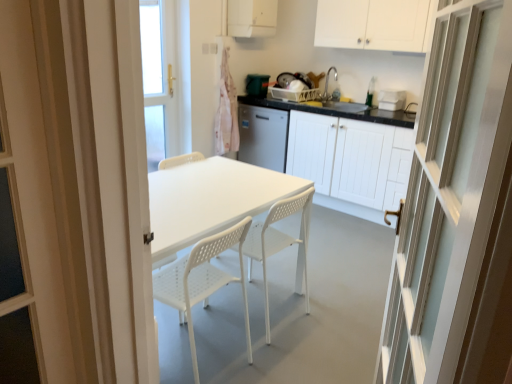
Question: Based on their sizes in the image, would you say white matte cabinet at upper center, the second cabinetry positioned from the top, is bigger or smaller than white plastic chair at center, which is the 1th chair from right to left?

Choices:
 (A) big
 (B) small

Answer: (A)

Question: Based on their positions, is white matte cabinet at upper center, which appears as the second cabinetry when ordered from the bottom, located to the left or right of white plastic chair at center, which is the 1th chair from right to left?

Choices:
 (A) left
 (B) right

Answer: (B)

Question: Which object is positioned farthest from the white plastic container at upper right, the first appliance positioned from the front?

Choices:
 (A) green plastic bin at upper center, positioned as the 2th appliance in front-to-back order
 (B) white matte cabinet at upper center, which appears as the second cabinetry when ordered from the bottom
 (C) white plastic chair at center, which is the second chair in right-to-left order
 (D) white plastic chair at center, which appears as the second chair when viewed from the left
 (E) white matte cabinet at upper center, the 1th cabinetry when ordered from top to bottom

Answer: (C)

Question: Considering the real-world distances, which object is farthest from the green plastic bin at upper center, which is the first appliance in back-to-front order?

Choices:
 (A) white matte cabinet at center, the 3th cabinetry from the top
 (B) white matte cabinet at upper center, the 1th cabinetry when ordered from top to bottom
 (C) white glossy door at right
 (D) white plastic chair at center, which is the 1th chair from right to left
 (E) white plastic chair at center, which is the second chair in right-to-left order

Answer: (C)